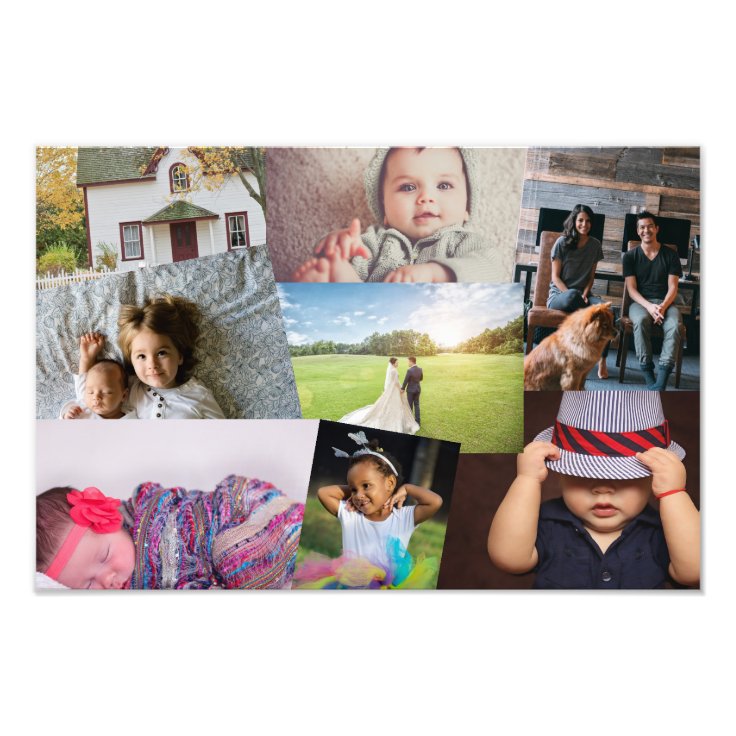
Where is `photos in collage`? photos in collage is located at coordinates (171, 233), (176, 314), (187, 474), (369, 505), (388, 355), (397, 230), (548, 233), (595, 489).